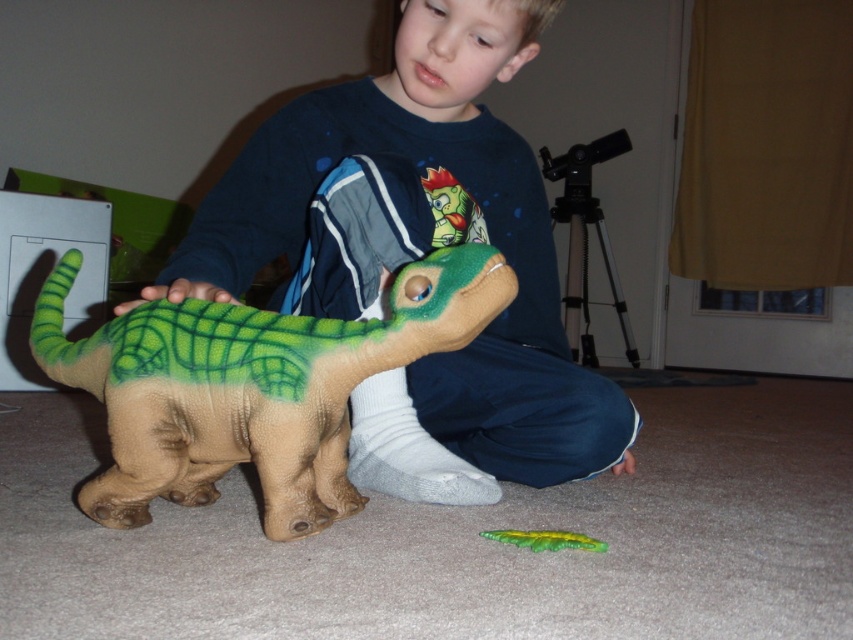
Can you confirm if soft plush dinosaur at center is taller than green matte toy at lower center?

Yes, soft plush dinosaur at center is taller than green matte toy at lower center.

Which is more to the right, soft plush dinosaur at center or green matte toy at lower center?

Positioned to the right is green matte toy at lower center.

This screenshot has width=853, height=640. What do you see at coordinates (418, 257) in the screenshot?
I see `soft plush dinosaur at center` at bounding box center [418, 257].

Identify the location of soft plush dinosaur at center. (418, 257).

Who is positioned more to the right, green matte dinosaur at lower left or green matte toy at lower center?

From the viewer's perspective, green matte toy at lower center appears more on the right side.

Which is behind, point (114, 330) or point (547, 547)?

The point (114, 330) is more distant.

You are a GUI agent. You are given a task and a screenshot of the screen. Output one action in this format:
    pyautogui.click(x=<x>, y=<y>)
    Task: Click on the green matte dinosaur at lower left
    
    Given the screenshot: What is the action you would take?
    pyautogui.click(x=251, y=387)

Is soft plush dinosaur at center thinner than green matte dinosaur at lower left?

Incorrect, soft plush dinosaur at center's width is not less than green matte dinosaur at lower left's.

Which is behind, point (476, 390) or point (198, 493)?

The point (476, 390) is more distant.

Is point (473, 358) more distant than point (492, 262)?

Yes, point (473, 358) is farther from viewer.

Locate an element on the screen. This screenshot has height=640, width=853. soft plush dinosaur at center is located at coordinates (418, 257).